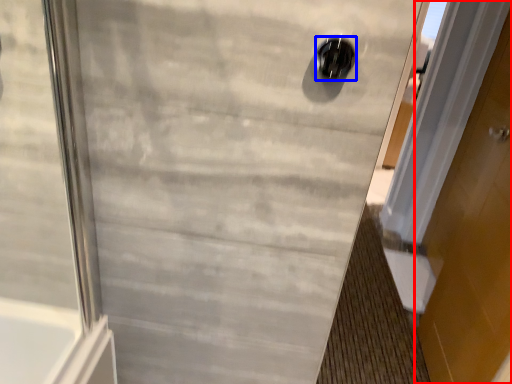
Question: Among these objects, which one is farthest to the camera, door (highlighted by a red box) or hole (highlighted by a blue box)?

Choices:
 (A) door
 (B) hole

Answer: (A)